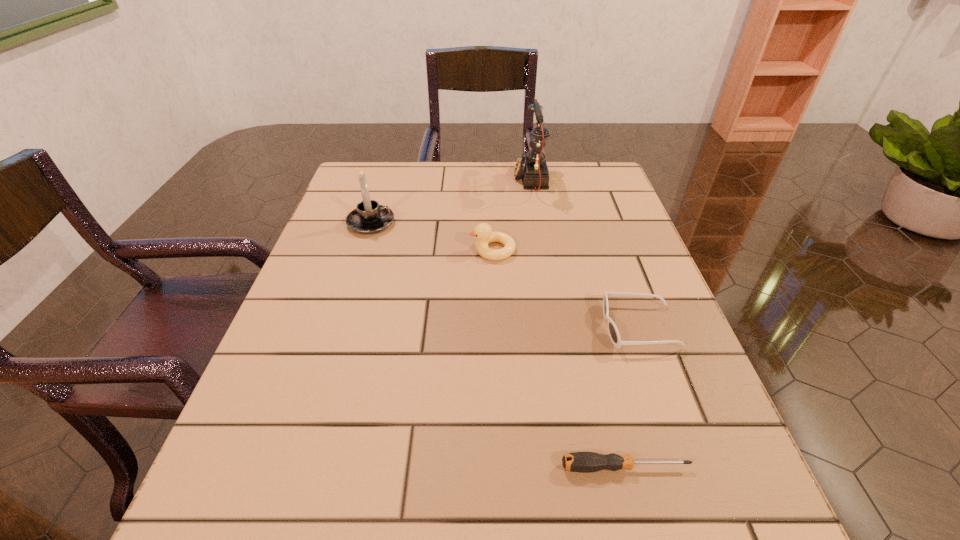
Where is `vacant space at the near left corner`? vacant space at the near left corner is located at coordinates (274, 512).

In the image, there is a desktop. In order to click on vacant space at the far right corner in this screenshot , I will do 583,161.

At what (x,y) coordinates should I click in order to perform the action: click on vacant space in between the third tallest object and the fourth farthest object. Please return your answer as a coordinate pair (x, y). Looking at the image, I should click on (566, 288).

The height and width of the screenshot is (540, 960). Find the location of `free spot between the leftmost object and the tallest object`. free spot between the leftmost object and the tallest object is located at coordinates (451, 201).

Find the location of a particular element. The image size is (960, 540). unoccupied area between the sunglasses and the screwdriver is located at coordinates (633, 397).

Find the location of a particular element. The image size is (960, 540). free area in between the fourth tallest object and the fourth object from right to left is located at coordinates (566, 288).

Locate an element on the screen. vacant region between the fourth tallest object and the tallest object is located at coordinates (585, 253).

Where is `vacant space in between the sunglasses and the shortest object`? Image resolution: width=960 pixels, height=540 pixels. vacant space in between the sunglasses and the shortest object is located at coordinates (633, 397).

Find the location of a particular element. free space between the third nearest object and the telephone is located at coordinates (512, 215).

This screenshot has height=540, width=960. Find the location of `free space between the second nearest object and the third tallest object`. free space between the second nearest object and the third tallest object is located at coordinates (566, 288).